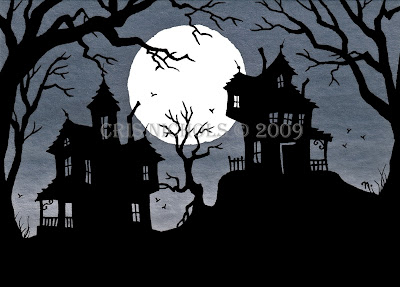
The image size is (400, 287). In order to click on chimney vent pipe in this screenshot , I will do `click(305, 86)`, `click(264, 59)`, `click(131, 126)`.